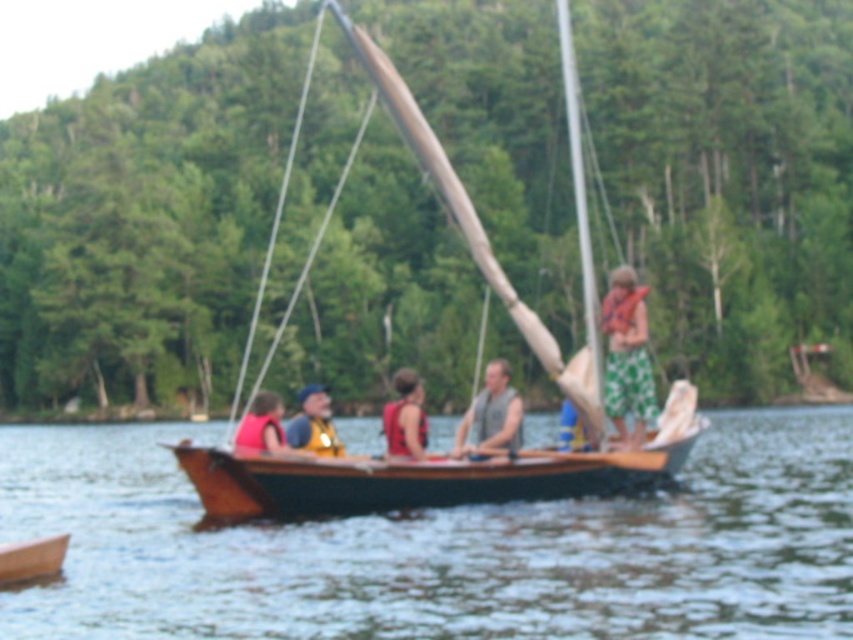
You are planning to take a group of 5 people on a short trip. You see the brown wooden boat at center and the wooden canoe at lower left in the image. Which vessel can accommodate all 5 people comfortably?

The brown wooden boat at center is larger in size than the wooden canoe at lower left, so it can accommodate all 5 people comfortably.

You are planning to take a group of five people on a short boat trip. You see the brown wooden boat at center and the wooden canoe at lower left. Which vessel can accommodate all five people comfortably?

The brown wooden boat at center can accommodate all five people comfortably since it is wider than the wooden canoe at lower left.

From the picture: You are a passenger on the sailboat and need to retrieve your life vest. Which life vest is closer to you, the wooden life vest at center or the blue fabric life vest at center?

The wooden life vest at center is closer to the viewer than the blue fabric life vest at center, so the wooden life vest at center is closer to you.